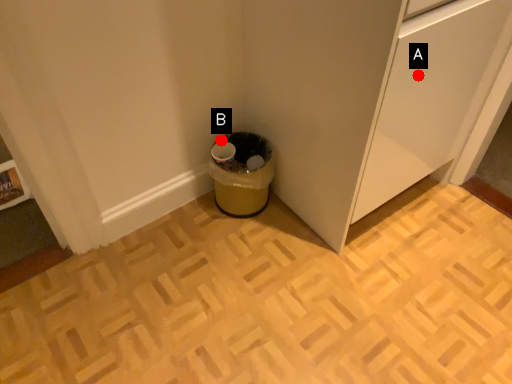
Question: Two points are circled on the image, labeled by A and B beside each circle. Which point is closer to the camera?

Choices:
 (A) A is closer
 (B) B is closer

Answer: (A)